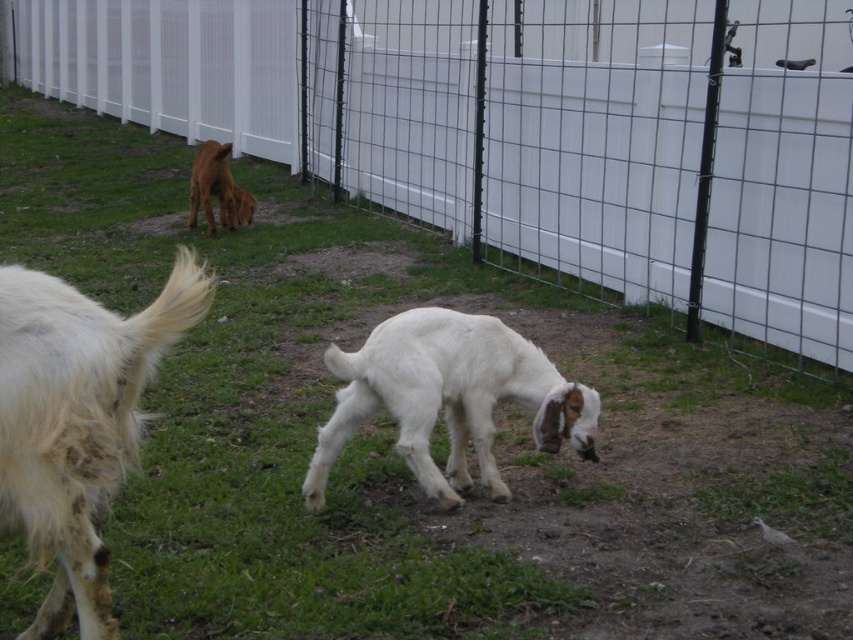
Question: Is white wire fence at center above brown fur dog at upper left?

Choices:
 (A) yes
 (B) no

Answer: (A)

Question: Among these points, which one is nearest to the camera?

Choices:
 (A) (241, 204)
 (B) (584, 74)
 (C) (416, 326)

Answer: (C)

Question: Is white woolen goat at center above brown fur dog at upper left?

Choices:
 (A) yes
 (B) no

Answer: (B)

Question: Which object is closer to the camera taking this photo?

Choices:
 (A) brown fur dog at upper left
 (B) white wire fence at center
 (C) white woolen goat at center

Answer: (C)

Question: Is white wire fence at center to the right of brown fur dog at upper left from the viewer's perspective?

Choices:
 (A) yes
 (B) no

Answer: (B)

Question: Which of the following is the farthest from the observer?

Choices:
 (A) white woolen goat at center
 (B) white wire fence at center

Answer: (B)